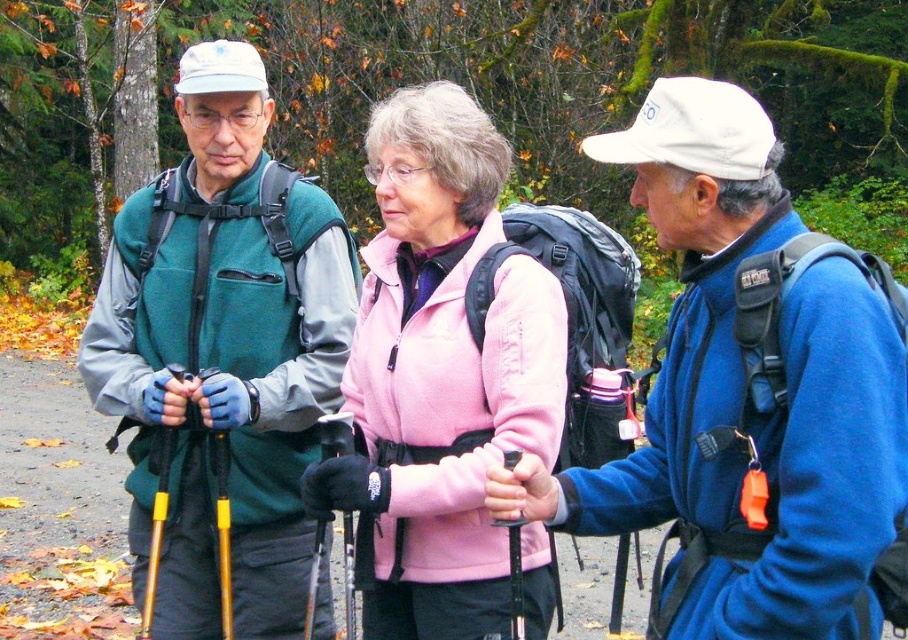
Question: Which point is closer to the camera taking this photo?

Choices:
 (A) (549, 616)
 (B) (281, 435)
 (C) (531, 500)

Answer: (C)

Question: Estimate the real-world distances between objects in this image. Which object is farther from the matte green vest at left?

Choices:
 (A) blue fleece jacket at center
 (B) pink fleece jacket at center

Answer: (A)

Question: Considering the real-world distances, which object is closest to the matte green vest at left?

Choices:
 (A) pink fleece jacket at center
 (B) blue fleece jacket at center

Answer: (A)

Question: From the image, what is the correct spatial relationship of blue fleece jacket at center in relation to matte green vest at left?

Choices:
 (A) above
 (B) below

Answer: (B)

Question: Can you confirm if matte green vest at left is bigger than pink fleece jacket at center?

Choices:
 (A) yes
 (B) no

Answer: (A)

Question: Does matte green vest at left appear on the left side of pink fleece jacket at center?

Choices:
 (A) no
 (B) yes

Answer: (B)